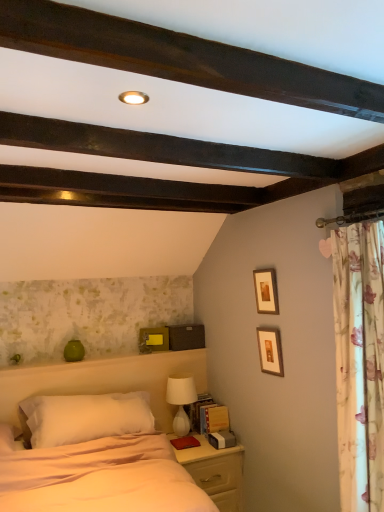
Question: Is yellow matte picture frame at upper center, positioned as the 3th picture frame in right-to-left order, shorter than wooden picture frame at upper center, marked as the 1th picture frame in a top-to-bottom arrangement?

Choices:
 (A) no
 (B) yes

Answer: (B)

Question: Does yellow matte picture frame at upper center, the first picture frame from the left, come behind wooden picture frame at upper center, which ranks as the 2th picture frame in back-to-front order?

Choices:
 (A) no
 (B) yes

Answer: (B)

Question: From the image's perspective, is yellow matte picture frame at upper center, the 1th picture frame from the bottom, located beneath wooden picture frame at upper center, acting as the third picture frame starting from the bottom?

Choices:
 (A) no
 (B) yes

Answer: (B)

Question: Is wooden picture frame at upper center, positioned as the 2th picture frame in left-to-right order, completely or partially inside yellow matte picture frame at upper center, arranged as the 1th picture frame when viewed from the back?

Choices:
 (A) no
 (B) yes

Answer: (A)

Question: Can you see yellow matte picture frame at upper center, the third picture frame in the front-to-back sequence, touching wooden picture frame at upper center, which ranks as the 2th picture frame in back-to-front order?

Choices:
 (A) no
 (B) yes

Answer: (A)

Question: Does point (69, 413) appear closer or farther from the camera than point (266, 291)?

Choices:
 (A) closer
 (B) farther

Answer: (A)

Question: Considering their positions, is white soft pillow at center located in front of or behind wooden picture frame at upper center, the second picture frame from the front?

Choices:
 (A) behind
 (B) front

Answer: (B)

Question: From a real-world perspective, is white soft pillow at center physically located above or below wooden picture frame at upper center, which ranks as the 2th picture frame in back-to-front order?

Choices:
 (A) above
 (B) below

Answer: (B)

Question: From their relative heights in the image, would you say white soft pillow at center is taller or shorter than wooden picture frame at upper center, which ranks as the 2th picture frame in back-to-front order?

Choices:
 (A) tall
 (B) short

Answer: (A)

Question: Considering their positions, is light wood nightstand at lower right located in front of or behind yellow matte picture frame at upper center, the 1th picture frame from the bottom?

Choices:
 (A) behind
 (B) front

Answer: (B)

Question: Which is correct: light wood nightstand at lower right is inside yellow matte picture frame at upper center, the 1th picture frame from the bottom, or outside of it?

Choices:
 (A) inside
 (B) outside

Answer: (B)

Question: Is light wood nightstand at lower right to the left or to the right of yellow matte picture frame at upper center, arranged as the 1th picture frame when viewed from the back, in the image?

Choices:
 (A) left
 (B) right

Answer: (B)

Question: Based on their sizes in the image, would you say light wood nightstand at lower right is bigger or smaller than yellow matte picture frame at upper center, the 1th picture frame from the bottom?

Choices:
 (A) small
 (B) big

Answer: (B)

Question: From a real-world perspective, is light wood nightstand at lower right above or below white soft bed at center?

Choices:
 (A) below
 (B) above

Answer: (A)

Question: Would you say light wood nightstand at lower right is to the left or to the right of white soft bed at center in the picture?

Choices:
 (A) right
 (B) left

Answer: (A)